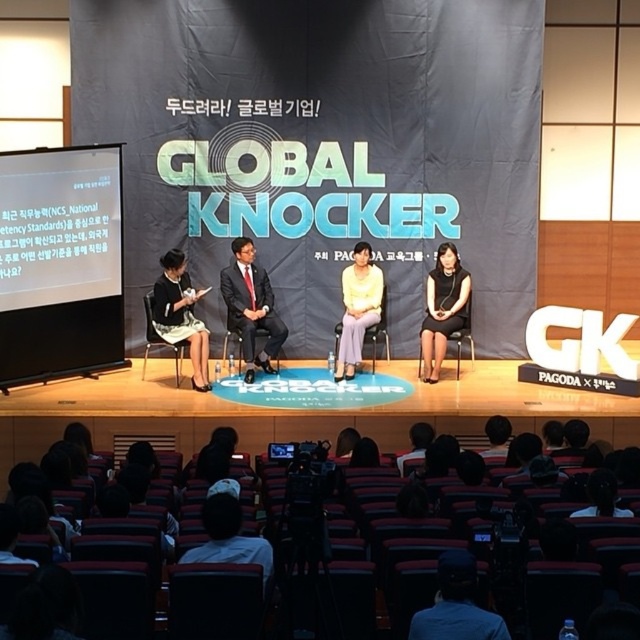
Who is taller, striped fabric shirt at lower center or metallic silver chair at center?

metallic silver chair at center

Describe the element at coordinates (228, 538) in the screenshot. I see `striped fabric shirt at lower center` at that location.

The width and height of the screenshot is (640, 640). In order to click on striped fabric shirt at lower center in this screenshot , I will do `click(228, 538)`.

Which of these two, dark suit at center or matte black dress at left, stands taller?

With more height is dark suit at center.

Is dark suit at center taller than matte black dress at left?

Correct, dark suit at center is much taller as matte black dress at left.

The height and width of the screenshot is (640, 640). Describe the element at coordinates (250, 307) in the screenshot. I see `dark suit at center` at that location.

Locate an element on the screen. This screenshot has width=640, height=640. dark suit at center is located at coordinates (250, 307).

Who is shorter, matte black dress at left or light yellow fabric blouse at center?

matte black dress at left

Which is in front, point (179, 307) or point (368, 304)?

Point (179, 307) is in front.

Does point (156, 317) come farther from viewer compared to point (349, 371)?

No, it is not.

Find the location of `matte black dress at left`. matte black dress at left is located at coordinates [180, 314].